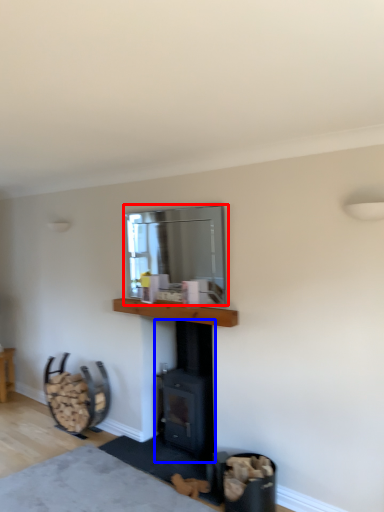
Question: Which of the following is the closest to the observer, window screen (highlighted by a red box) or wood burning stove (highlighted by a blue box)?

Choices:
 (A) window screen
 (B) wood burning stove

Answer: (A)